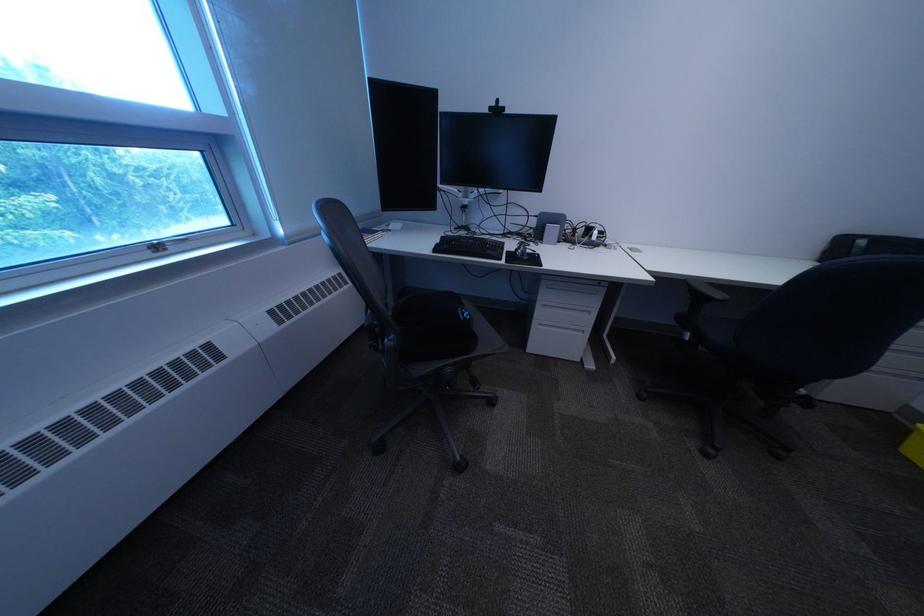
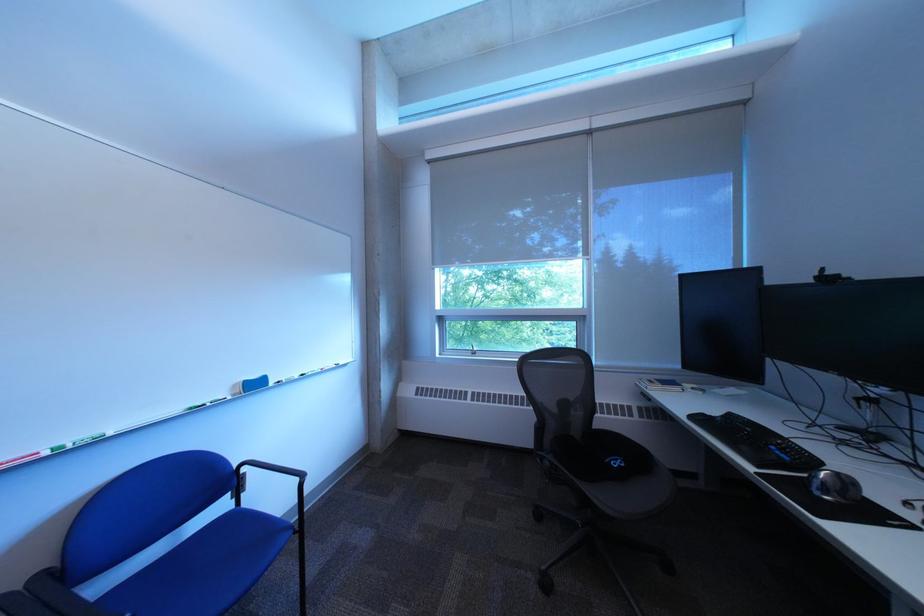
The point at (x=516, y=107) is marked in the first image. Where is the corresponding point in the second image?

(843, 275)